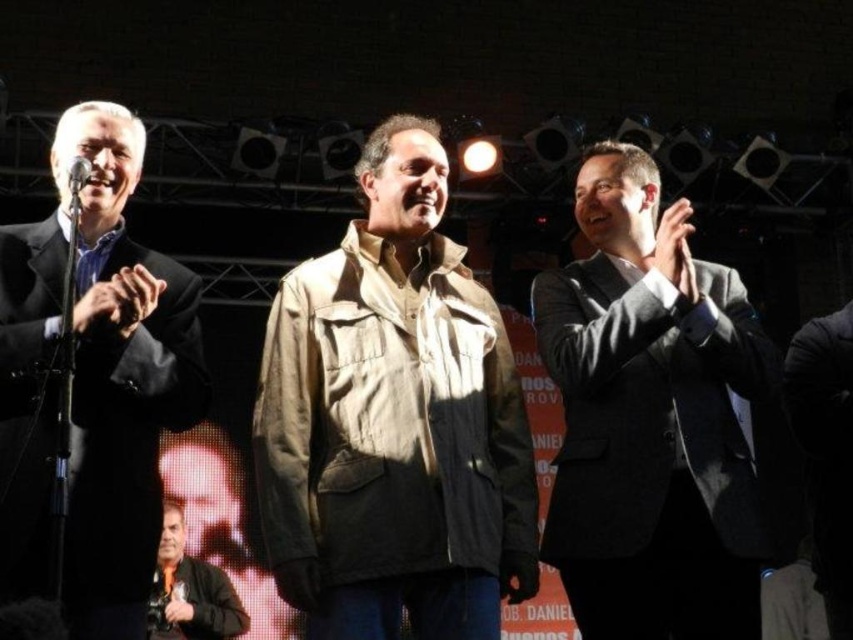
You are standing at the back of the event venue and want to determine which of the two points, point 1 at coordinates point [180,515] or point 2 at coordinates point [77,161], is closer to you. Based on the image, which point is nearer?

Point [180,515] is further to the viewer than point [77,161], so point [77,161] is closer to you.